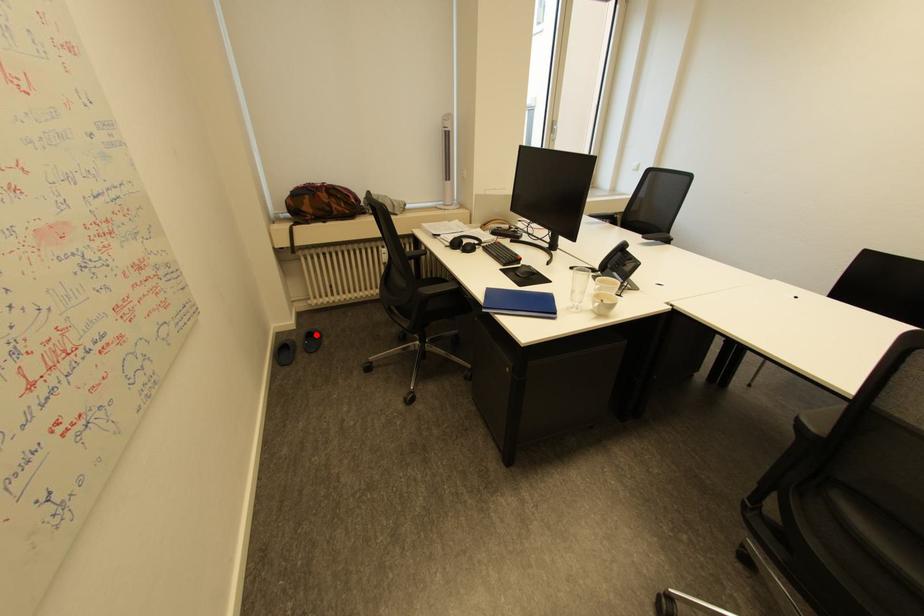
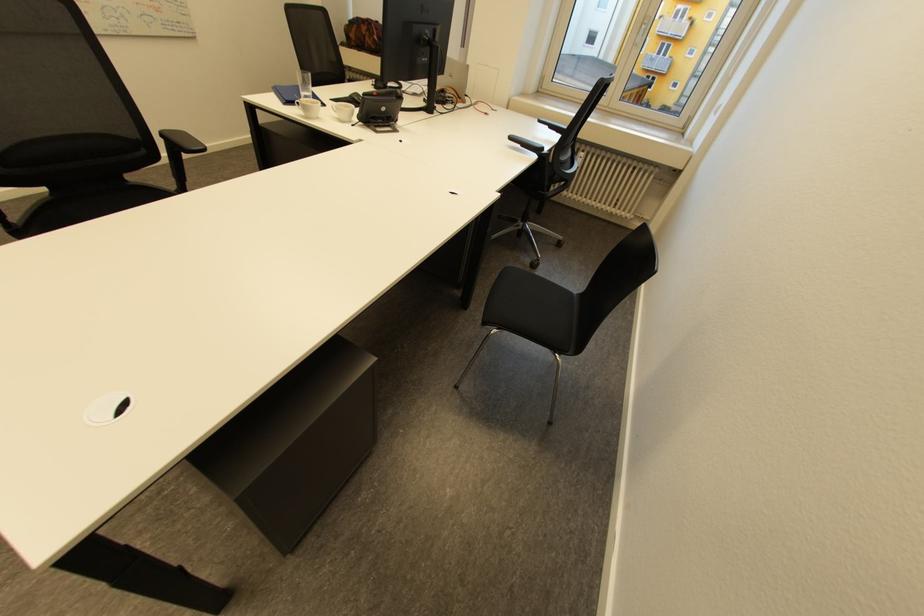
Question: I am providing you with two images of the same scene from different viewpoints. A red point is marked on the first image. Can you still see the location of the red point in image 2?

Choices:
 (A) Yes
 (B) No

Answer: (B)